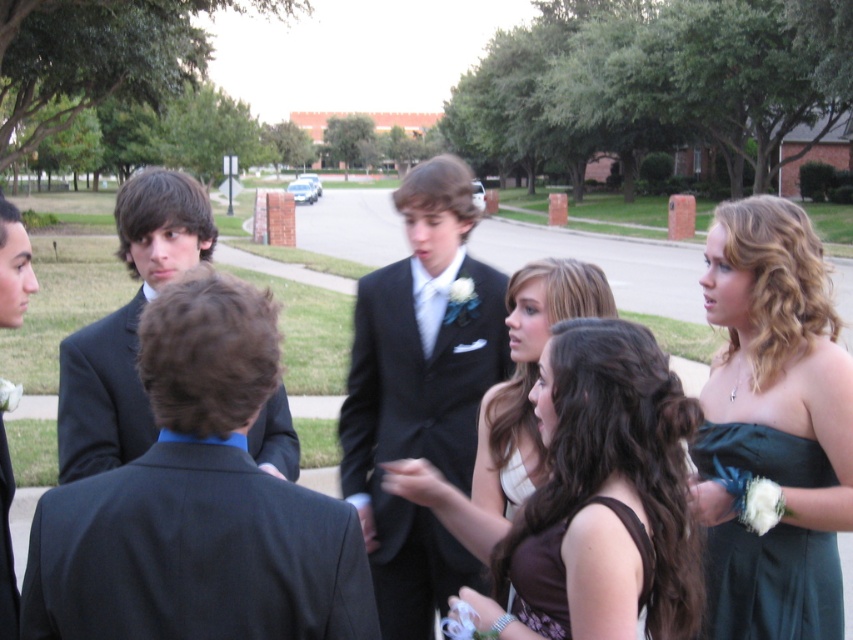
Question: Which point appears closest to the camera in this image?

Choices:
 (A) (506, 484)
 (B) (440, 244)
 (C) (525, 476)
 (D) (323, 538)

Answer: (D)

Question: Does matte black suit at center appear on the left side of dark green satin dress at lower right?

Choices:
 (A) yes
 (B) no

Answer: (A)

Question: Which object is positioned farthest from the dark green satin dress at right?

Choices:
 (A) brown satin dress at lower center
 (B) matte black suit at left

Answer: (B)

Question: Estimate the real-world distances between objects in this image. Which object is farther from the matte brown dress at center?

Choices:
 (A) brown satin dress at center
 (B) dark green satin dress at lower right
 (C) brown satin dress at lower center
 (D) matte black dress at lower left

Answer: (D)

Question: Does dark green satin dress at right lie in front of dark green satin dress at lower right?

Choices:
 (A) yes
 (B) no

Answer: (A)

Question: Where is black wool suit at center located in relation to dark green satin dress at lower right in the image?

Choices:
 (A) above
 (B) below

Answer: (A)